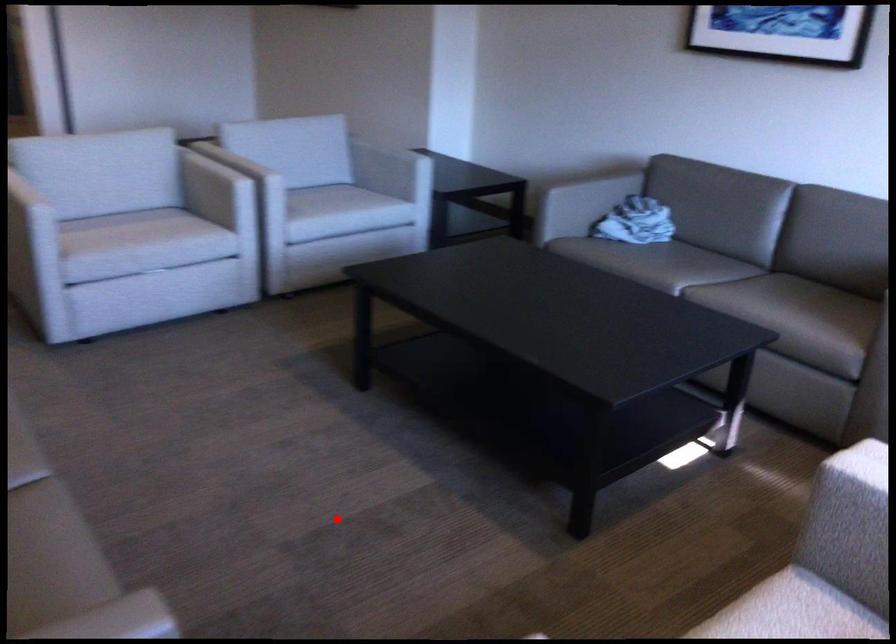
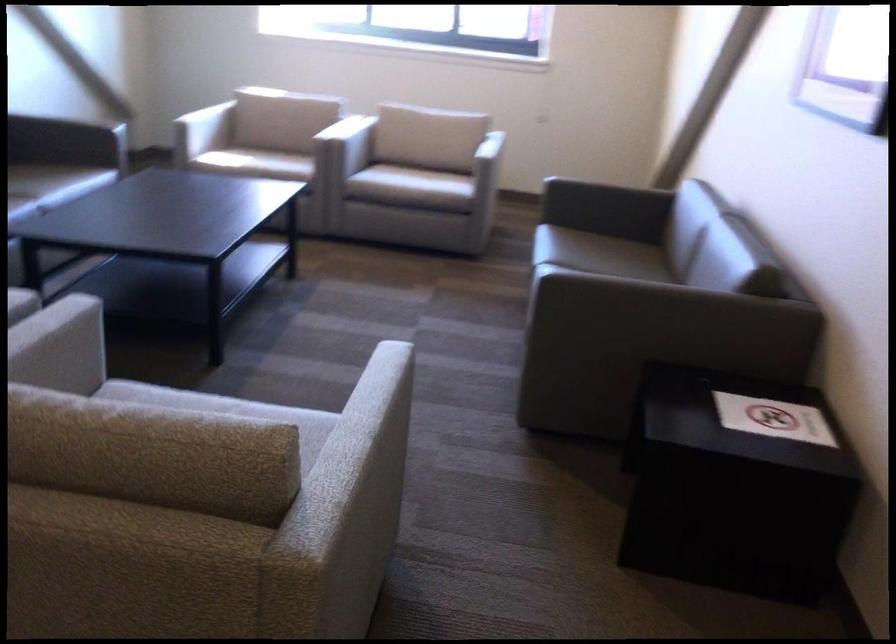
Question: A red point is marked in image1. In image2, is the corresponding 3D point closer to the camera or farther? Reply with the corresponding letter.

Choices:
 (A) The corresponding 3D point is closer.
 (B) The corresponding 3D point is farther.

Answer: (B)